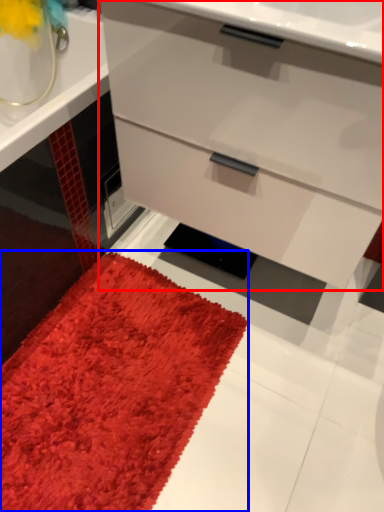
Question: Which point is further to the camera, chest of drawers (highlighted by a red box) or mat (highlighted by a blue box)?

Choices:
 (A) chest of drawers
 (B) mat

Answer: (B)